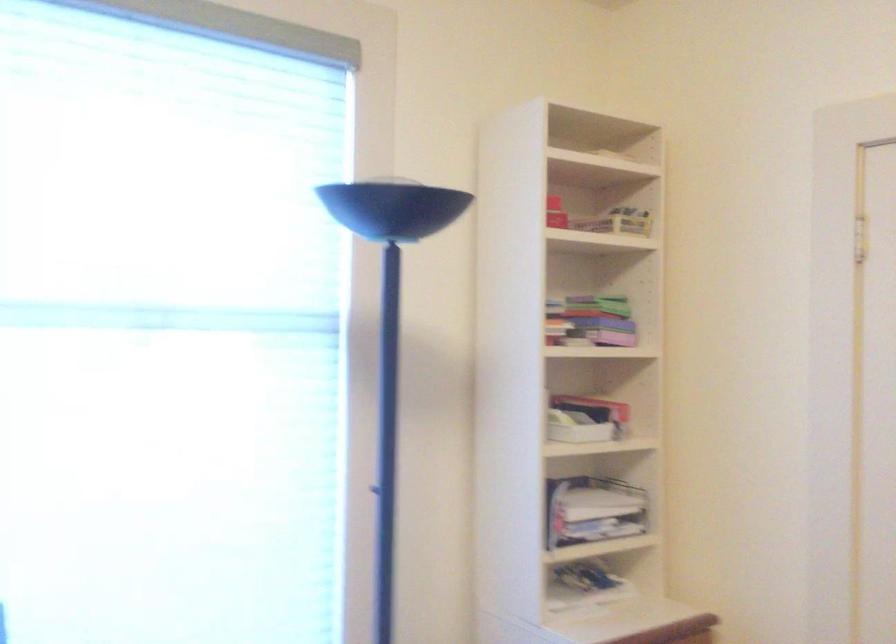
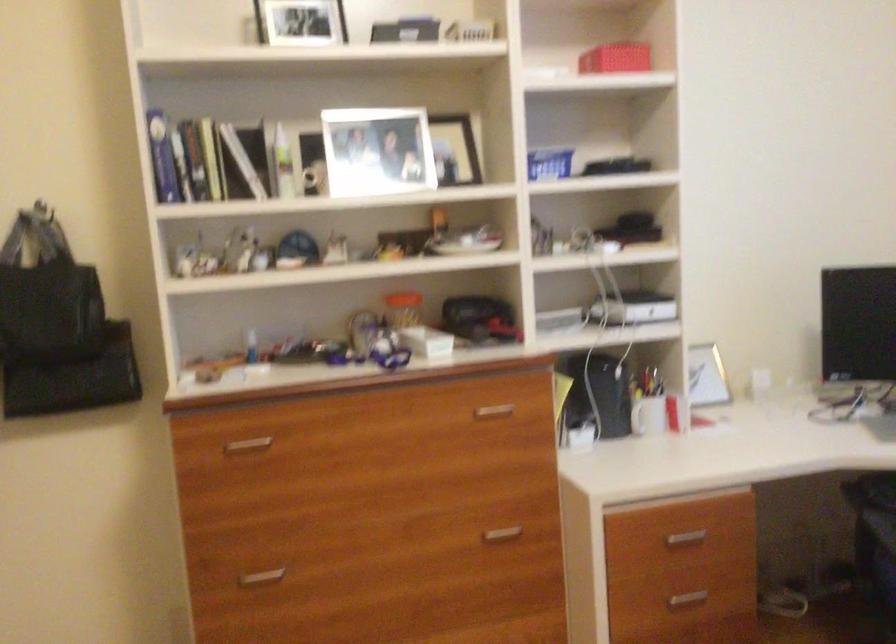
Question: How did the camera likely rotate?

Choices:
 (A) Left
 (B) Right
 (C) Up
 (D) Down

Answer: (A)